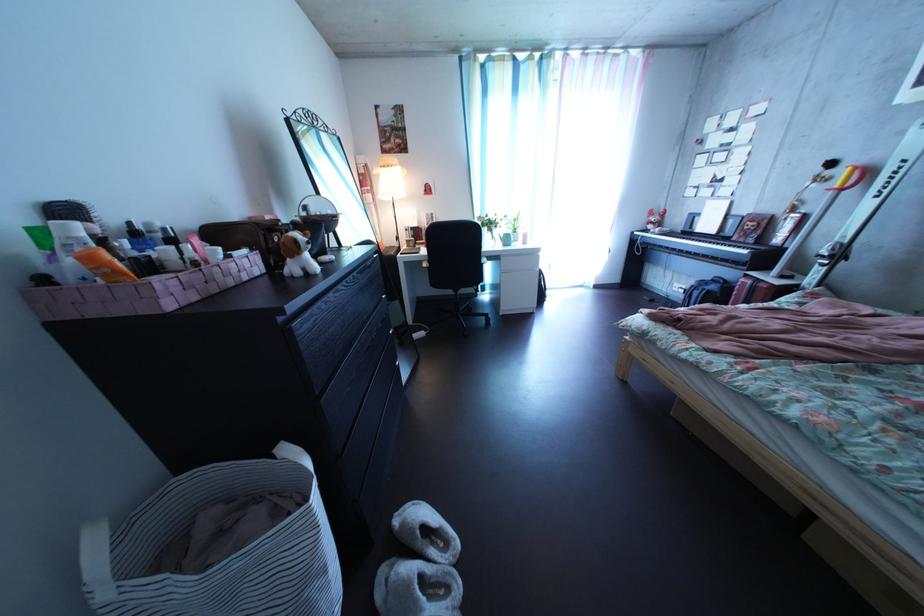
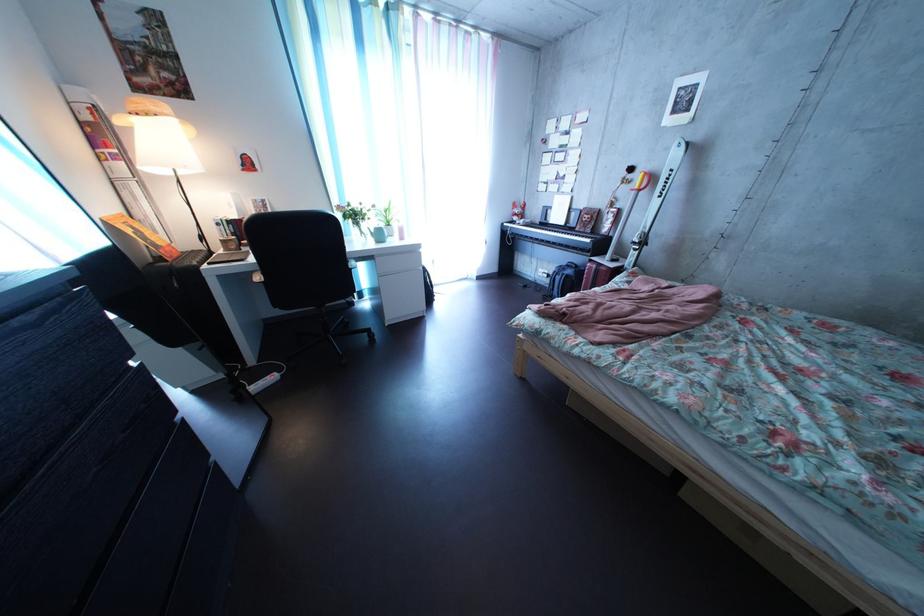
Locate, in the second image, the point that corresponds to point (684, 282) in the first image.

(550, 269)